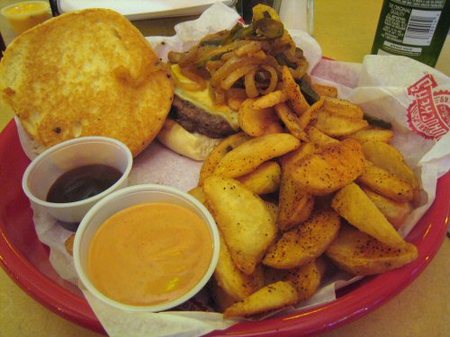
Locate an element on the screen. The width and height of the screenshot is (450, 337). bottle is located at coordinates (433, 53).